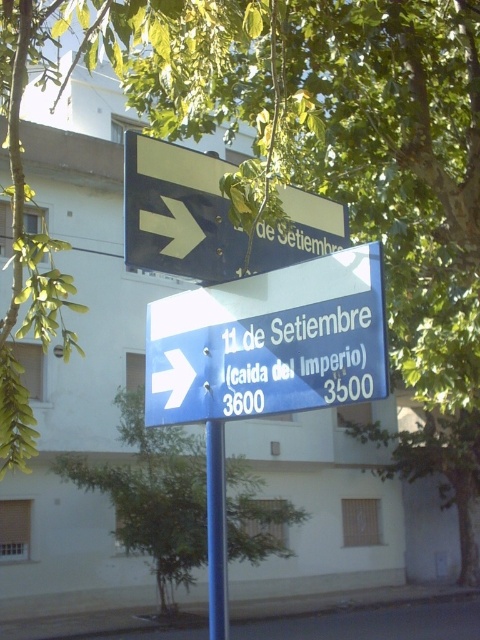
Question: Is blue plastic sign at center positioned in front of blue plastic pole at lower center?

Choices:
 (A) yes
 (B) no

Answer: (A)

Question: Among these objects, which one is nearest to the camera?

Choices:
 (A) black plastic sign at upper right
 (B) blue plastic sign at center
 (C) white matte arrow at upper right
 (D) green leafy tree at lower center

Answer: (B)

Question: Is black plastic sign at upper right further to camera compared to white plastic arrow at center?

Choices:
 (A) yes
 (B) no

Answer: (B)

Question: Does blue plastic pole at lower center have a greater width compared to white matte arrow at upper right?

Choices:
 (A) no
 (B) yes

Answer: (B)

Question: Estimate the real-world distances between objects in this image. Which object is farther from the white matte arrow at upper right?

Choices:
 (A) blue plastic sign at center
 (B) black plastic sign at upper right

Answer: (A)

Question: Which object is the farthest from the blue plastic sign at center?

Choices:
 (A) white matte arrow at upper right
 (B) blue plastic pole at lower center
 (C) white plastic arrow at center
 (D) black plastic sign at upper right

Answer: (B)